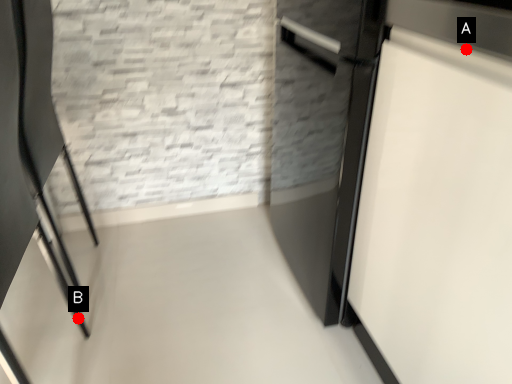
Question: Two points are circled on the image, labeled by A and B beside each circle. Which point is further to the camera?

Choices:
 (A) A is further
 (B) B is further

Answer: (B)